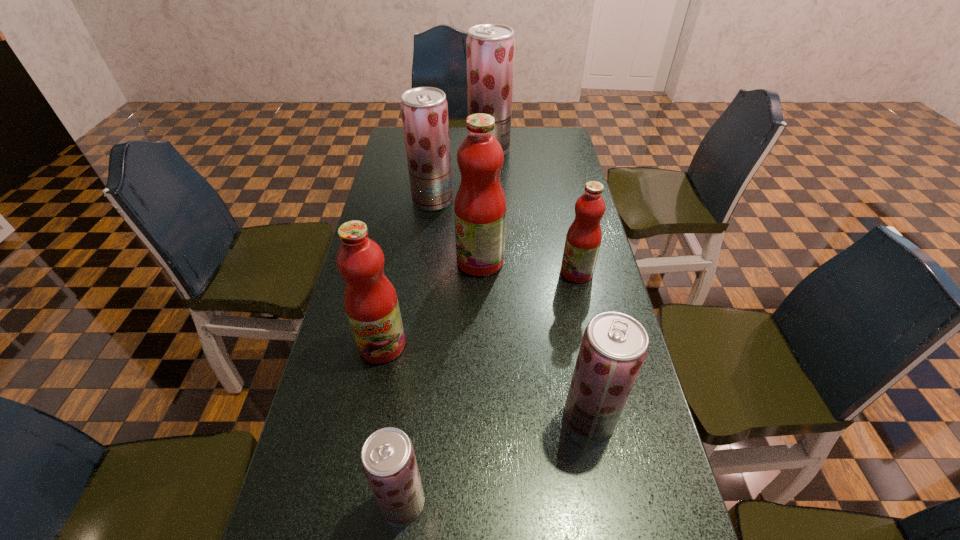
I want to click on vacant space in between the second pink fruit juice from left to right and the nearest pink fruit juice, so click(x=431, y=303).

Image resolution: width=960 pixels, height=540 pixels. What are the coordinates of `unoccupied position between the shortest fruit juice and the rightmost pink fruit juice` in the screenshot? It's located at (490, 387).

Where is `vacant region between the nearest pink fruit juice and the shortest object`? This screenshot has width=960, height=540. vacant region between the nearest pink fruit juice and the shortest object is located at coordinates (393, 423).

Point out which object is positioned as the third nearest to the smallest pink fruit juice. Please provide its 2D coordinates. Your answer should be formatted as a tuple, i.e. [(x, y)], where the tuple contains the x and y coordinates of a point satisfying the conditions above.

[(424, 110)]

Locate an element on the screen. The height and width of the screenshot is (540, 960). the sixth closest object to the smallest strawberry fruit juice is located at coordinates (490, 48).

Select which fruit juice appears as the closest to the biggest pink fruit juice. Please provide its 2D coordinates. Your answer should be formatted as a tuple, i.e. [(x, y)], where the tuple contains the x and y coordinates of a point satisfying the conditions above.

[(583, 239)]

Identify which fruit juice is located as the sixth nearest to the farthest fruit juice. Please provide its 2D coordinates. Your answer should be formatted as a tuple, i.e. [(x, y)], where the tuple contains the x and y coordinates of a point satisfying the conditions above.

[(388, 459)]

Identify which strawberry fruit juice is located as the nearest to the second pink fruit juice from right to left. Please provide its 2D coordinates. Your answer should be formatted as a tuple, i.e. [(x, y)], where the tuple contains the x and y coordinates of a point satisfying the conditions above.

[(424, 110)]

What are the coordinates of `strawberry fruit juice that is the third closest to the third nearest fruit juice` in the screenshot? It's located at (424, 110).

Locate an element on the screen. Image resolution: width=960 pixels, height=540 pixels. pink fruit juice that is the third nearest to the nearest strawberry fruit juice is located at coordinates (583, 239).